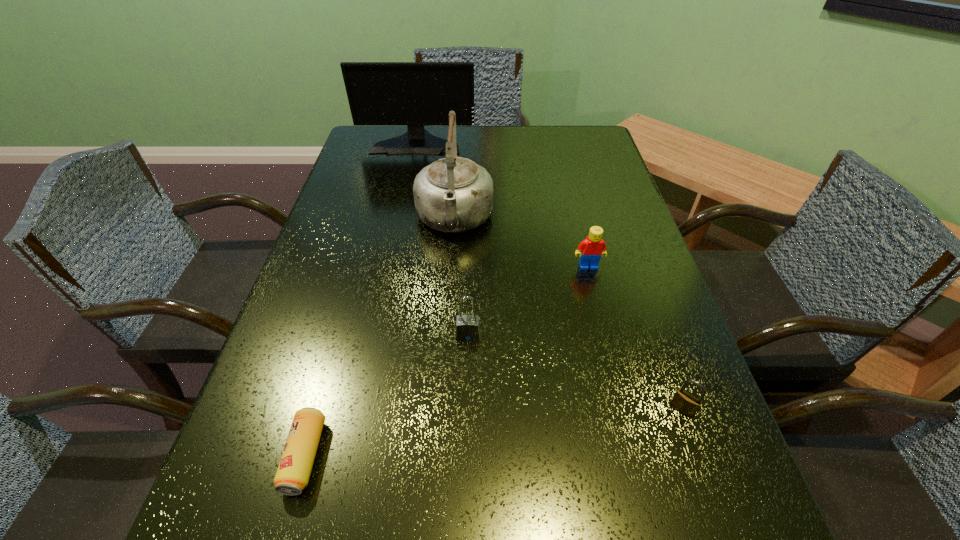
In order to click on free space between the fifth tallest object and the second object from right to left in this screenshot , I will do `click(636, 338)`.

The height and width of the screenshot is (540, 960). Find the location of `vacant region between the beer can and the second shortest object`. vacant region between the beer can and the second shortest object is located at coordinates (493, 433).

Where is `free spot between the shortest object and the right padlock`? The height and width of the screenshot is (540, 960). free spot between the shortest object and the right padlock is located at coordinates (493, 433).

This screenshot has height=540, width=960. Identify the location of free area in between the farther padlock and the fourth nearest object. (528, 301).

Locate an element on the screen. vacant space that's between the monitor and the fifth object from left to right is located at coordinates (502, 205).

Point out which object is positioned as the third nearest to the left padlock. Please provide its 2D coordinates. Your answer should be formatted as a tuple, i.e. [(x, y)], where the tuple contains the x and y coordinates of a point satisfying the conditions above.

[(590, 250)]

Locate an element on the screen. the second closest object relative to the fifth object from left to right is located at coordinates (467, 326).

Locate an element on the screen. The height and width of the screenshot is (540, 960). vacant space that satisfies the following two spatial constraints: 1. on the face of the fourth nearest object; 2. on the right side of the shorter padlock is located at coordinates (624, 409).

Image resolution: width=960 pixels, height=540 pixels. I want to click on free space that satisfies the following two spatial constraints: 1. at the spout of the second nearest object; 2. on the right side of the second farthest object, so click(442, 409).

Where is `free space that satisfies the following two spatial constraints: 1. at the spout of the kettle; 2. on the right side of the right padlock`? This screenshot has width=960, height=540. free space that satisfies the following two spatial constraints: 1. at the spout of the kettle; 2. on the right side of the right padlock is located at coordinates (442, 409).